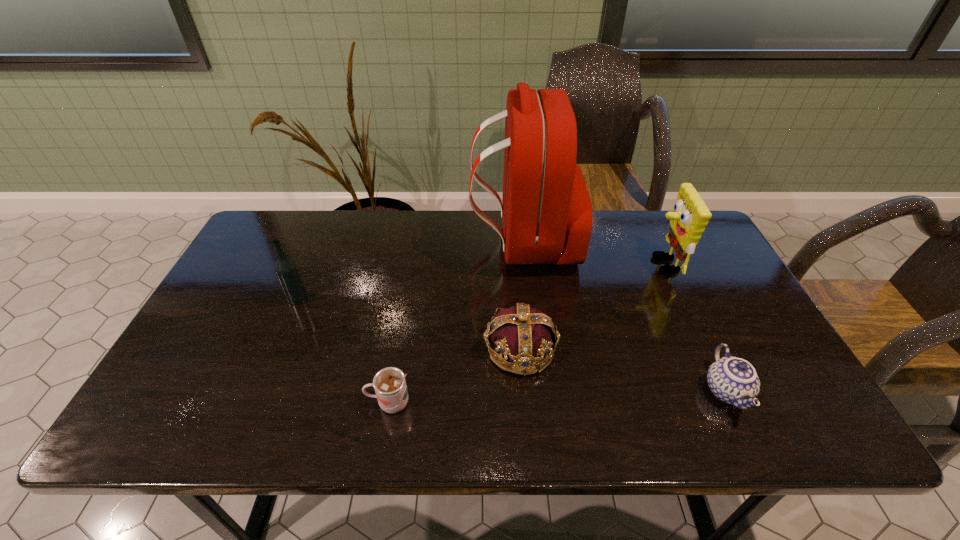
Image resolution: width=960 pixels, height=540 pixels. I want to click on cup located at the near edge, so click(389, 383).

This screenshot has height=540, width=960. In order to click on chinaware at the near edge in this screenshot , I will do coord(733,380).

Find the location of a particular element. Image resolution: width=960 pixels, height=540 pixels. sponge that is at the right edge is located at coordinates (690, 217).

Find the location of a particular element. The width and height of the screenshot is (960, 540). chinaware present at the right edge is located at coordinates click(x=733, y=380).

Image resolution: width=960 pixels, height=540 pixels. I want to click on object that is at the far right corner, so click(x=690, y=217).

Identify the location of object present at the near right corner. (733, 380).

Identify the location of free space at the far edge of the desktop. (325, 222).

Locate an element on the screen. The width and height of the screenshot is (960, 540). vacant region at the near edge is located at coordinates point(279,432).

Locate an element on the screen. The width and height of the screenshot is (960, 540). free region at the left edge of the desktop is located at coordinates (188, 346).

Image resolution: width=960 pixels, height=540 pixels. I want to click on vacant area at the right edge, so click(x=722, y=327).